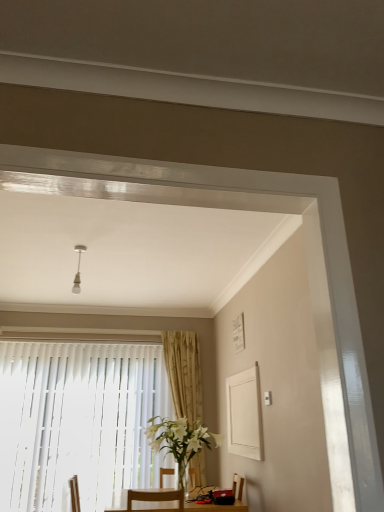
Question: Does gold textured curtain at center contain white vertical blinds at lower left?

Choices:
 (A) no
 (B) yes

Answer: (A)

Question: Is gold textured curtain at center not close to white vertical blinds at lower left?

Choices:
 (A) yes
 (B) no

Answer: (B)

Question: Is gold textured curtain at center completely or partially outside of white vertical blinds at lower left?

Choices:
 (A) yes
 (B) no

Answer: (A)

Question: From a real-world perspective, is gold textured curtain at center over white vertical blinds at lower left?

Choices:
 (A) yes
 (B) no

Answer: (A)

Question: Can you confirm if gold textured curtain at center is smaller than white vertical blinds at lower left?

Choices:
 (A) no
 (B) yes

Answer: (B)

Question: Considering the relative sizes of gold textured curtain at center and white vertical blinds at lower left in the image provided, is gold textured curtain at center shorter than white vertical blinds at lower left?

Choices:
 (A) yes
 (B) no

Answer: (A)

Question: Can you confirm if white glass vase at center is wider than gold textured curtain at center?

Choices:
 (A) yes
 (B) no

Answer: (A)

Question: Does white glass vase at center have a larger size compared to gold textured curtain at center?

Choices:
 (A) no
 (B) yes

Answer: (B)

Question: From the image's perspective, is white glass vase at center below gold textured curtain at center?

Choices:
 (A) no
 (B) yes

Answer: (B)

Question: Is white glass vase at center facing towards gold textured curtain at center?

Choices:
 (A) no
 (B) yes

Answer: (A)

Question: Is white glass vase at center positioned before gold textured curtain at center?

Choices:
 (A) no
 (B) yes

Answer: (B)

Question: Considering the relative sizes of white glass vase at center and gold textured curtain at center in the image provided, is white glass vase at center smaller than gold textured curtain at center?

Choices:
 (A) no
 (B) yes

Answer: (A)

Question: Is white vertical blinds at lower left positioned with its back to white glass vase at center?

Choices:
 (A) yes
 (B) no

Answer: (B)